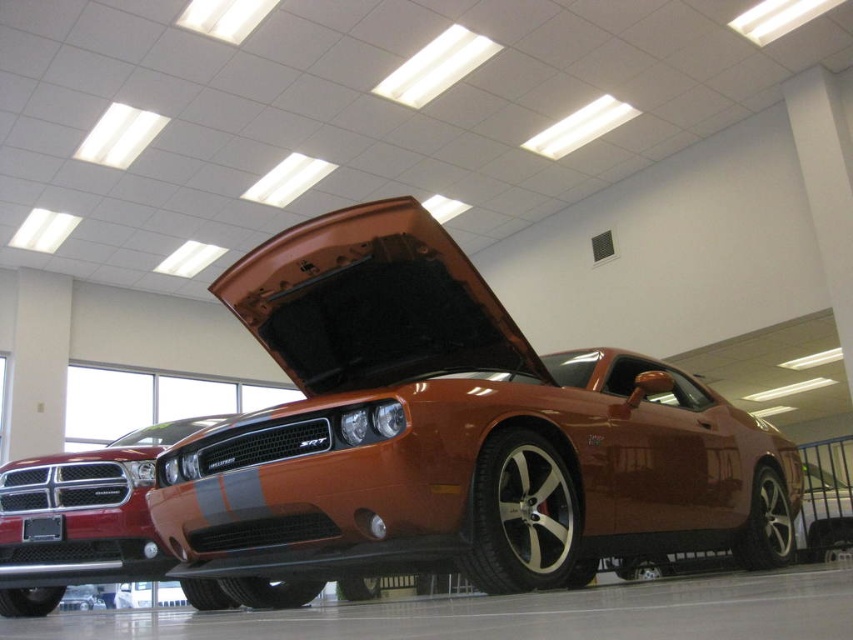
You are standing in the showroom and want to take a photo of the orange Dodge Challenger SRT with the red Challenger in the background. If you move closer to the point at coordinates point (x=724, y=445), will the red Challenger still be visible in the background?

The point at coordinates point (x=724, y=445) is 12.02 feet from the camera. Since the red Challenger is in the background and partially obscured by the orange Challenger, moving closer to the point may block the view of the red Challenger further, but as the point is still 12 feet away, the red Challenger might still be partially visible depending on the camera angle and zoom. However, based on the given information, the exact visibility cannot be determined without additional details about the camera setup.

You are a mechanic who needs to work on both the orange matte hood at center and the glossy metallic car at center. Since you have a limited workspace, you want to know which one takes up more space. Which car part has a wider width?

The glossy metallic car at center has a wider width than the orange matte hood at center.

You are a car enthusiast trying to park your 2.5 meters wide car in a garage that can only accommodate vehicles up to 2.4 meters in width. You see the shiny orange muscle car at center and the glossy metallic car at center in the showroom. Which car should you choose as a reference to determine if your car will fit in the garage?

The shiny orange muscle car at center is wider than the glossy metallic car at center. Since your car is 2.5 meters wide and the garage allows up to 2.4 meters, you should avoid using the shiny orange muscle car at center as a reference. Instead, compare with the glossy metallic car at center, which is narrower. If your car is wider than the glossy metallic car at center, it might not fit.